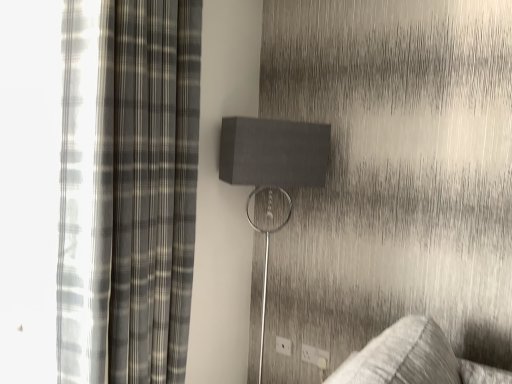
Question: Is white plastic electric outlet at lower center, which is counted as the 1th electric outlet, starting from the back, a part of white plastic electric outlet at lower right, placed as the third electric outlet when sorted from left to right?

Choices:
 (A) no
 (B) yes

Answer: (A)

Question: Does white plastic electric outlet at lower right, placed as the third electric outlet when sorted from left to right, appear on the left side of white plastic electric outlet at lower center, the 1th electric outlet when ordered from left to right?

Choices:
 (A) no
 (B) yes

Answer: (A)

Question: Is white plastic electric outlet at lower right, placed as the third electric outlet when sorted from left to right, touching white plastic electric outlet at lower center, which is counted as the 1th electric outlet, starting from the back?

Choices:
 (A) yes
 (B) no

Answer: (B)

Question: From a real-world perspective, is white plastic electric outlet at lower right, placed as the third electric outlet when sorted from left to right, physically above white plastic electric outlet at lower center, marked as the third electric outlet in a front-to-back arrangement?

Choices:
 (A) no
 (B) yes

Answer: (A)

Question: Does white plastic electric outlet at lower right, placed as the third electric outlet when sorted from left to right, have a smaller size compared to white plastic electric outlet at lower center, the 1th electric outlet when ordered from left to right?

Choices:
 (A) no
 (B) yes

Answer: (B)

Question: From a real-world perspective, is white plastic electric outlet at lower right, the 1th electric outlet when ordered from right to left, physically located above or below white plastic electric outlet at lower center, the 1th electric outlet when ordered from left to right?

Choices:
 (A) above
 (B) below

Answer: (B)

Question: Do you think white plastic electric outlet at lower right, placed as the third electric outlet when sorted from left to right, is within white plastic electric outlet at lower center, marked as the third electric outlet in a front-to-back arrangement, or outside of it?

Choices:
 (A) outside
 (B) inside

Answer: (A)

Question: Considering the positions of white plastic electric outlet at lower right, placed as the third electric outlet when sorted from left to right, and white plastic electric outlet at lower center, marked as the third electric outlet in a front-to-back arrangement, in the image, is white plastic electric outlet at lower right, placed as the third electric outlet when sorted from left to right, wider or thinner than white plastic electric outlet at lower center, marked as the third electric outlet in a front-to-back arrangement,?

Choices:
 (A) wide
 (B) thin

Answer: (A)

Question: Is white plastic electric outlet at lower right, marked as the 1th electric outlet in a front-to-back arrangement, in front of or behind white plastic electric outlet at lower center, marked as the third electric outlet in a front-to-back arrangement, in the image?

Choices:
 (A) behind
 (B) front

Answer: (B)

Question: Is white plastic electric outlet at lower center, the 3th electric outlet from the right, wider or thinner than plaid fabric curtain at left?

Choices:
 (A) thin
 (B) wide

Answer: (A)

Question: Would you say white plastic electric outlet at lower center, the 3th electric outlet from the right, is to the left or to the right of plaid fabric curtain at left in the picture?

Choices:
 (A) right
 (B) left

Answer: (A)

Question: From the image's perspective, is white plastic electric outlet at lower center, the 3th electric outlet from the right, positioned above or below plaid fabric curtain at left?

Choices:
 (A) below
 (B) above

Answer: (A)

Question: Relative to plaid fabric curtain at left, is white plastic electric outlet at lower center, the 3th electric outlet from the right, in front or behind?

Choices:
 (A) behind
 (B) front

Answer: (A)

Question: Choose the correct answer: Is white plastic electric outlet at lower center, which appears as the second electric outlet when viewed from the back, inside plaid fabric curtain at left or outside it?

Choices:
 (A) outside
 (B) inside

Answer: (A)

Question: Is white plastic electric outlet at lower center, positioned as the 2th electric outlet in left-to-right order, in front of or behind plaid fabric curtain at left in the image?

Choices:
 (A) front
 (B) behind

Answer: (B)